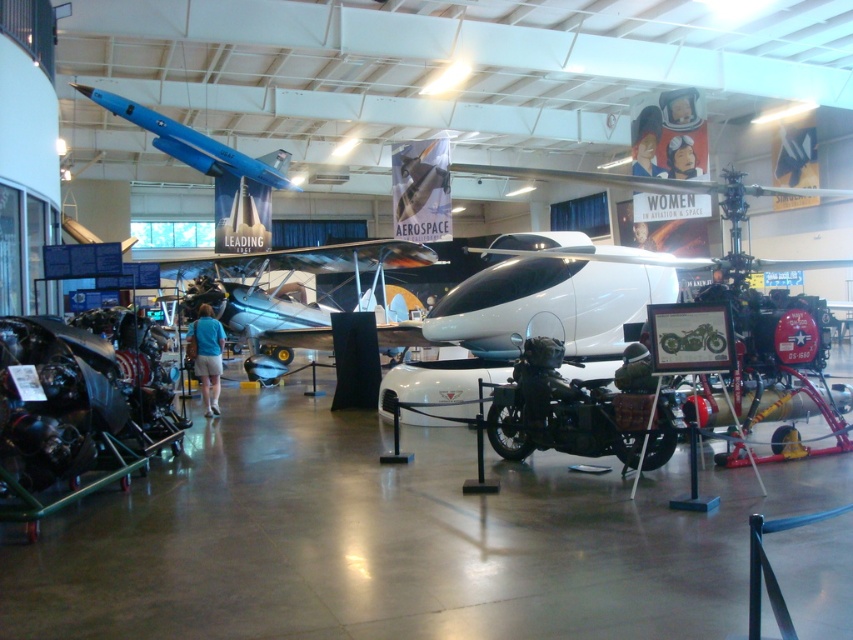
Question: Does shiny black motorcycle at center appear over blue matte airplane at upper center?

Choices:
 (A) yes
 (B) no

Answer: (B)

Question: Which point is farther from the camera taking this photo?

Choices:
 (A) (219, 148)
 (B) (378, 259)
 (C) (613, 426)

Answer: (A)

Question: Which is nearer to the silver metallic airplane at center?

Choices:
 (A) shiny black motorcycle at center
 (B) blue matte airplane at upper center

Answer: (B)

Question: Which object is the farthest from the shiny black motorcycle at center?

Choices:
 (A) silver metallic airplane at center
 (B) blue matte airplane at upper center

Answer: (B)

Question: In this image, where is shiny black motorcycle at center located relative to silver metallic airplane at center?

Choices:
 (A) below
 (B) above

Answer: (A)

Question: Can you confirm if shiny black motorcycle at center is smaller than blue matte airplane at upper center?

Choices:
 (A) no
 (B) yes

Answer: (B)